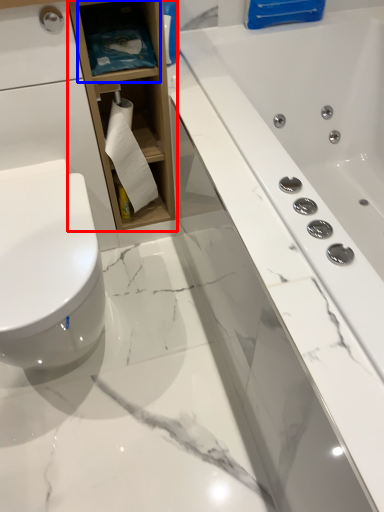
Question: Which object is closer to the camera taking this photo, bathroom cabinet (highlighted by a red box) or shelf (highlighted by a blue box)?

Choices:
 (A) bathroom cabinet
 (B) shelf

Answer: (A)